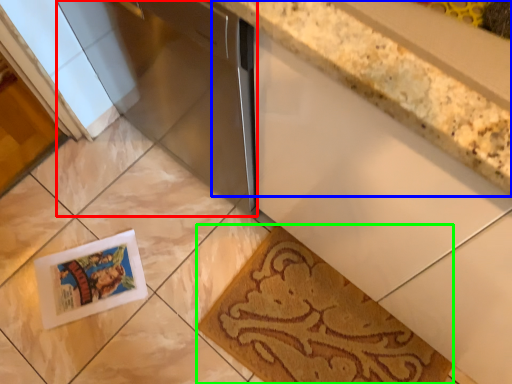
Question: Estimate the real-world distances between objects in this image. Which object is farther from appliance (highlighted by a red box), countertop (highlighted by a blue box) or mat (highlighted by a green box)?

Choices:
 (A) countertop
 (B) mat

Answer: (B)